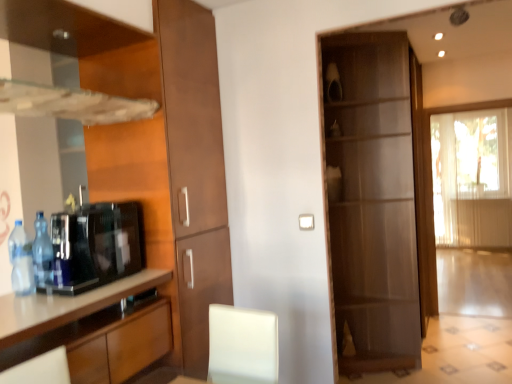
You are a GUI agent. You are given a task and a screenshot of the screen. Output one action in this format:
    pyautogui.click(x=<x>, y=<y>)
    Task: Click on the space that is in front of blue plastic bottle at left, marked as the second bottle in a back-to-front arrangement
    
    Given the screenshot: What is the action you would take?
    [x=17, y=301]